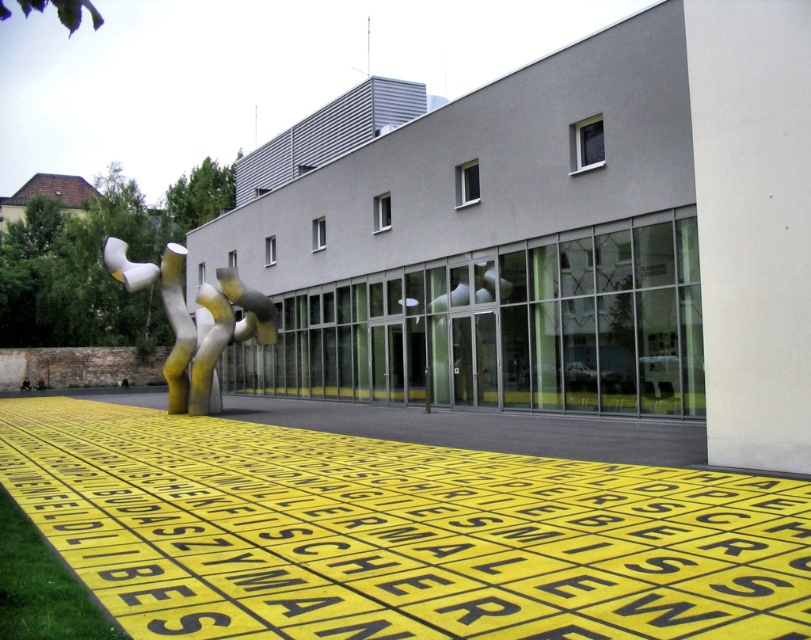
Question: Which point is closer to the camera?

Choices:
 (A) polished stainless steel sculpture at center
 (B) yellow plastic sign at lower center
 (C) polished white sculpture at center

Answer: (B)

Question: Does yellow plastic sign at lower center appear on the left side of polished white sculpture at center?

Choices:
 (A) yes
 (B) no

Answer: (A)

Question: Estimate the real-world distances between objects in this image. Which object is farther from the polished white sculpture at center?

Choices:
 (A) polished stainless steel sculpture at center
 (B) yellow plastic sign at lower center

Answer: (B)

Question: From the image, what is the correct spatial relationship of yellow plastic sign at lower center in relation to polished white sculpture at center?

Choices:
 (A) left
 (B) right

Answer: (A)

Question: Can you confirm if polished stainless steel sculpture at center is thinner than polished white sculpture at center?

Choices:
 (A) yes
 (B) no

Answer: (B)

Question: Which point is farther to the camera?

Choices:
 (A) polished stainless steel sculpture at center
 (B) yellow plastic sign at lower center

Answer: (A)